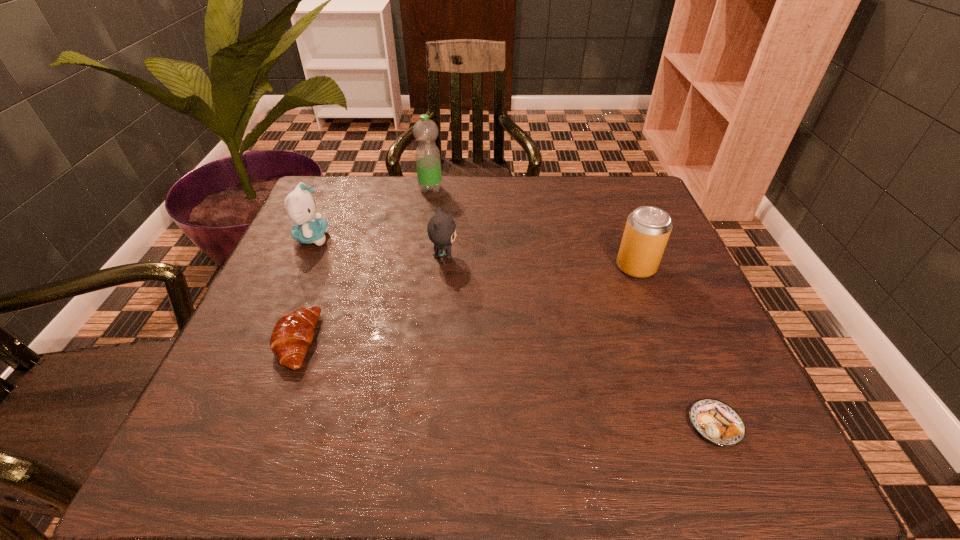
This screenshot has height=540, width=960. I want to click on the fourth closest object to the crescent roll, so click(647, 230).

Locate which object is the fourth closest to the pastry. Please provide its 2D coordinates. Your answer should be formatted as a tuple, i.e. [(x, y)], where the tuple contains the x and y coordinates of a point satisfying the conditions above.

[(428, 164)]

Where is `free space in the image that satisfies the following two spatial constraints: 1. on the front side of the pop (soda); 2. on the left side of the farthest object`? Image resolution: width=960 pixels, height=540 pixels. free space in the image that satisfies the following two spatial constraints: 1. on the front side of the pop (soda); 2. on the left side of the farthest object is located at coordinates (419, 267).

What are the coordinates of `vacant position in the image that satisfies the following two spatial constraints: 1. on the face of the left kitten; 2. on the right side of the shortest object` in the screenshot? It's located at (228, 424).

The height and width of the screenshot is (540, 960). What are the coordinates of `vacant space that satisfies the following two spatial constraints: 1. on the front-facing side of the third shortest object; 2. on the back side of the pop (soda)` in the screenshot? It's located at (443, 267).

Find the location of `blank area in the image that satisfies the following two spatial constraints: 1. on the front-facing side of the pop (soda); 2. on the right side of the right kitten`. blank area in the image that satisfies the following two spatial constraints: 1. on the front-facing side of the pop (soda); 2. on the right side of the right kitten is located at coordinates (443, 267).

At what (x,y) coordinates should I click in order to perform the action: click on free space that satisfies the following two spatial constraints: 1. on the front side of the tallest object; 2. on the face of the left kitten. Please return your answer as a coordinate pair (x, y). This screenshot has height=540, width=960. Looking at the image, I should click on (423, 238).